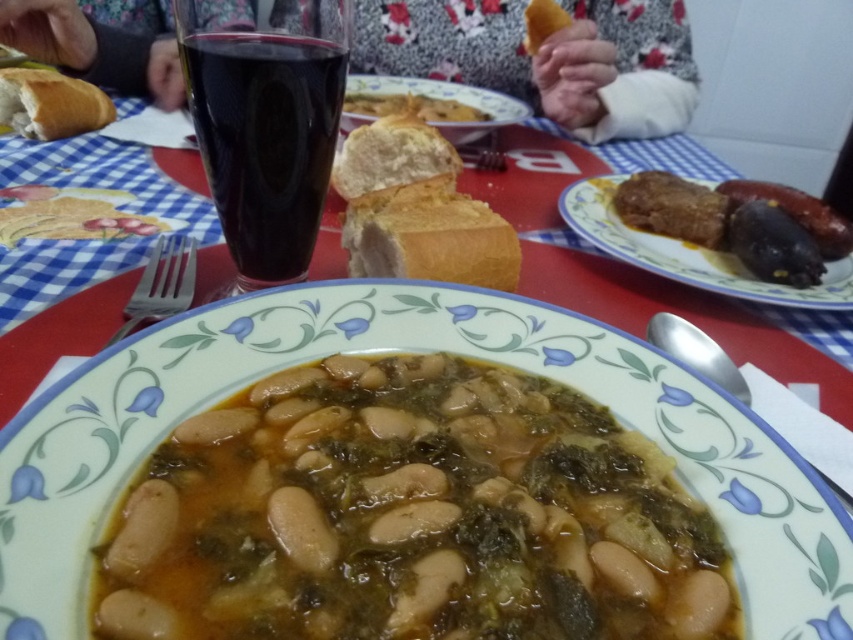
You are sitting at the table and want to place your napkin on the floral patterned sweater at upper center. The coordinates given are for the exact spot where the sweater is located. Can you confirm if the point at coordinate (546, 58) is indeed on the floral patterned sweater at upper center?

Yes, the point at coordinate (546, 58) is on the floral patterned sweater at upper center as stated in the description.

You are sitting at the table with the red and blue checkered tablecloth and notice a point marked at coordinates (546, 58). What object is located at that point?

The point at coordinates (546, 58) marks the location of the floral patterned sweater at upper center.